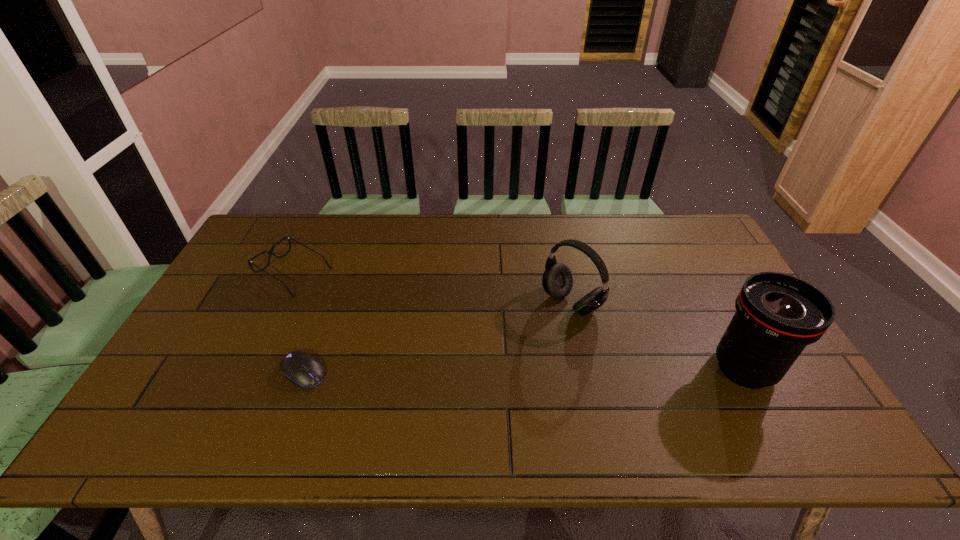
Find the location of a particular element. free space that satisfies the following two spatial constraints: 1. on the front side of the second tallest object; 2. on the left side of the spectacles is located at coordinates (279, 303).